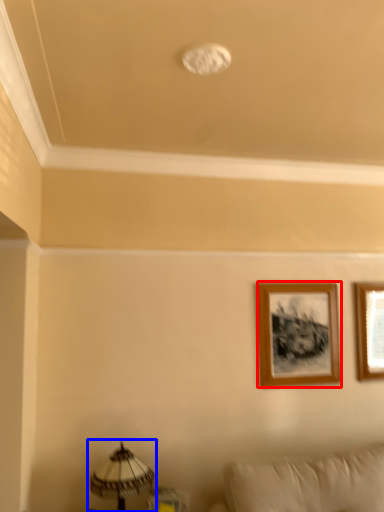
Question: Which object is closer to the camera taking this photo, picture frame (highlighted by a red box) or table lamp (highlighted by a blue box)?

Choices:
 (A) picture frame
 (B) table lamp

Answer: (B)